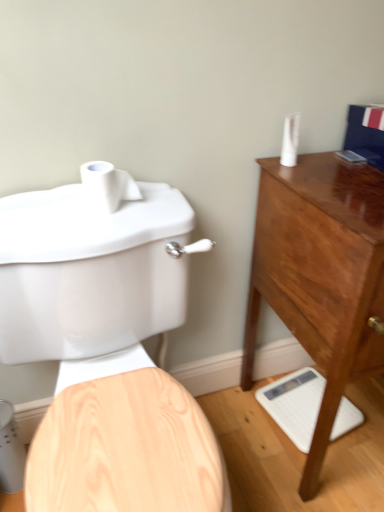
This screenshot has width=384, height=512. In order to click on vacant region under mahogany wood chest of drawers at right (from a real-world perspective) in this screenshot , I will do `click(357, 431)`.